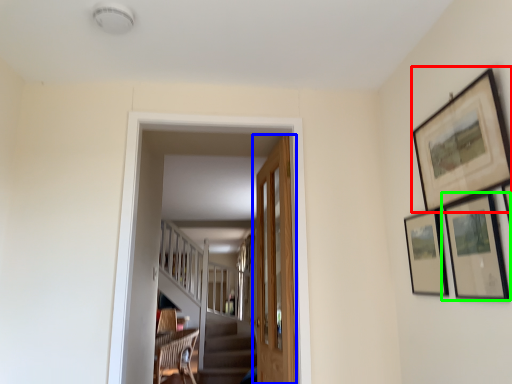
Question: Estimate the real-world distances between objects in this image. Which object is closer to picture frame (highlighted by a red box), door (highlighted by a blue box) or picture frame (highlighted by a green box)?

Choices:
 (A) door
 (B) picture frame

Answer: (B)